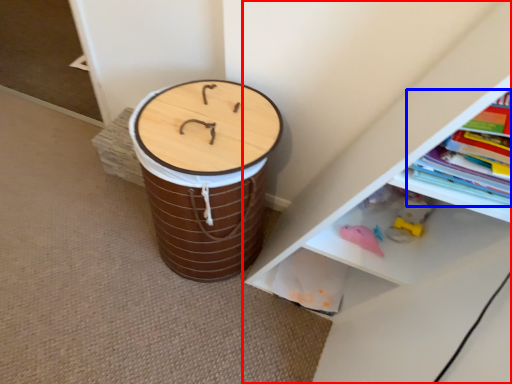
Question: Among these objects, which one is nearest to the camera, shelf (highlighted by a red box) or book (highlighted by a blue box)?

Choices:
 (A) shelf
 (B) book

Answer: (A)